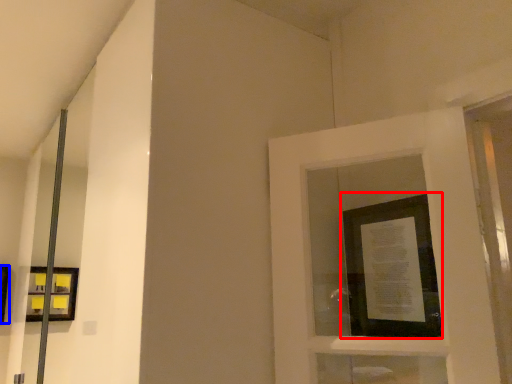
Question: Among these objects, which one is farthest to the camera, picture frame (highlighted by a red box) or picture frame (highlighted by a blue box)?

Choices:
 (A) picture frame
 (B) picture frame

Answer: (B)